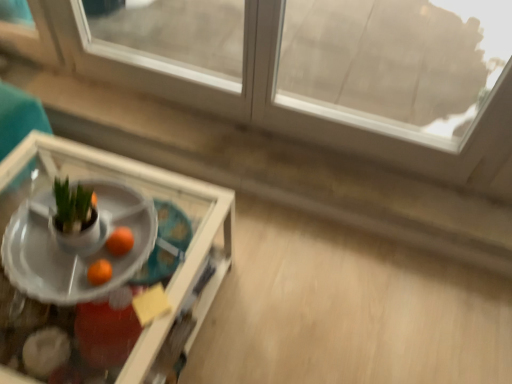
Locate an element on the screen. blank space situated above clear glass tray at lower left, the second table from the back (from a real-world perspective) is located at coordinates (55, 237).